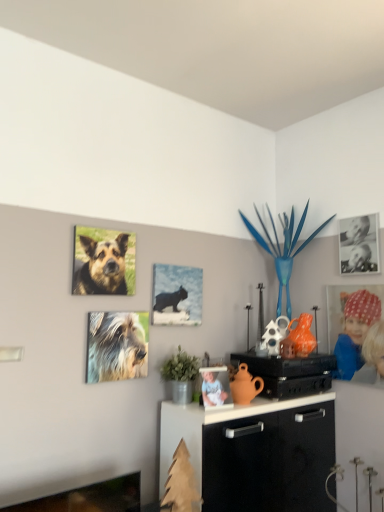
Question: Is point (273, 245) positioned closer to the camera than point (142, 334)?

Choices:
 (A) closer
 (B) farther

Answer: (B)

Question: Looking at their shapes, would you say metallic blue plant at upper center is wider or thinner than fuzzy fur dog at upper left, the 2th dog positioned from the top?

Choices:
 (A) thin
 (B) wide

Answer: (B)

Question: Which is farther from the black paper photo at upper right, which is the first picture frame from right to left?

Choices:
 (A) polka dot fabric headband at right, which is the first person in right-to-left order
 (B) matte black cat at center, positioned as the first picture frame in left-to-right order
 (C) metallic blue plant at upper center
 (D) white porcelain figurine at center, marked as the 2th person in a right-to-left arrangement
 (E) matte black speaker at center

Answer: (D)

Question: Estimate the real-world distances between objects in this image. Which object is farther from the white porcelain figurine at center, the first person from the left?

Choices:
 (A) matte black cat at center, which appears as the second picture frame when viewed from the top
 (B) fuzzy fur dog at upper left, the 1th dog positioned from the bottom
 (C) metallic blue plant at upper center
 (D) matte black speaker at center
 (E) brown fur dog at upper left, positioned as the second dog in bottom-to-top order

Answer: (C)